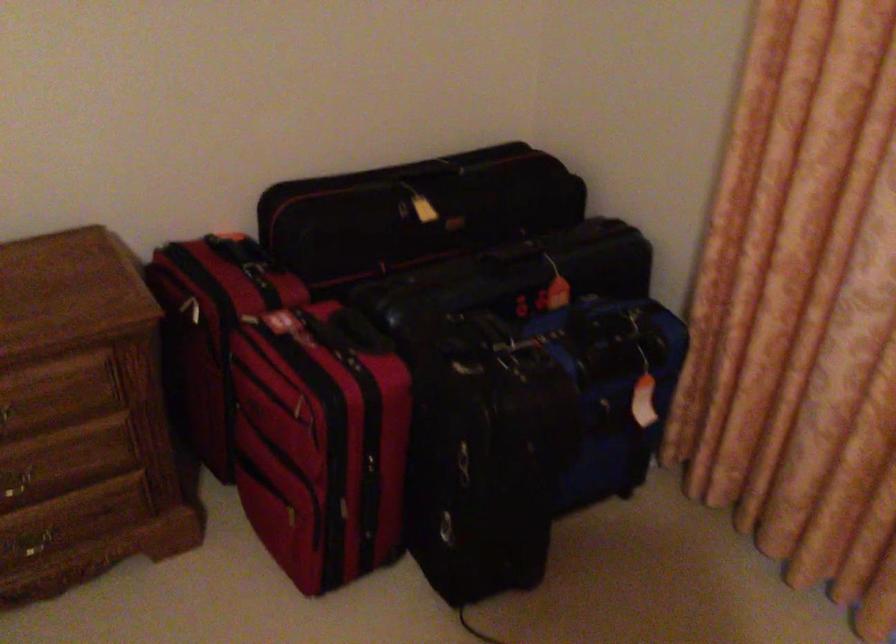
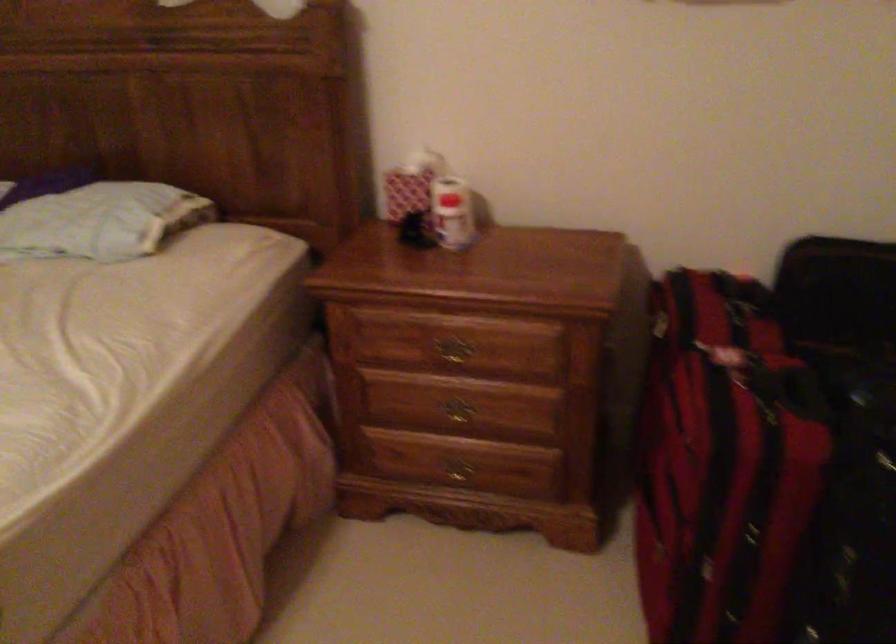
Question: The camera is either moving clockwise (left) or counter-clockwise (right) around the object. The first image is from the beginning of the video and the second image is from the end. Is the camera moving left or right when shooting the video?

Choices:
 (A) Left
 (B) Right

Answer: (B)